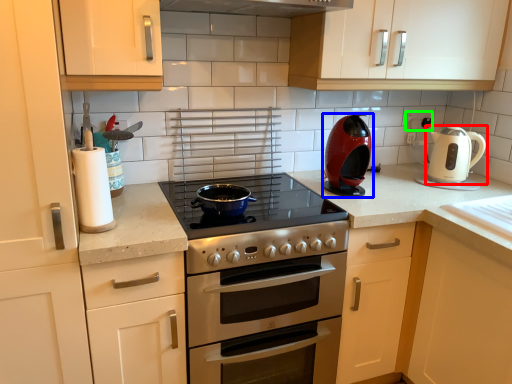
Question: Which object is the closest to the kitchen appliance (highlighted by a red box)? Choose among these: kitchen appliance (highlighted by a blue box) or electric outlet (highlighted by a green box).

Choices:
 (A) kitchen appliance
 (B) electric outlet

Answer: (B)